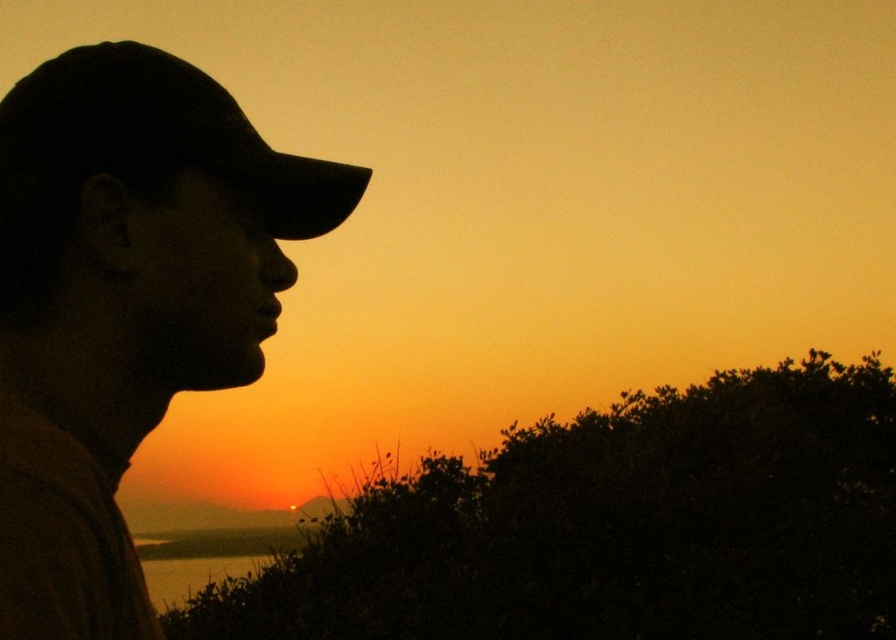
Can you confirm if silhouette cap at left is bigger than black matte baseball hat at left?

Yes, silhouette cap at left is bigger than black matte baseball hat at left.

Between silhouette cap at left and black matte baseball hat at left, which one has less height?

black matte baseball hat at left

Who is more distant from viewer, (22, 317) or (145, 61)?

The point (145, 61) is more distant.

Image resolution: width=896 pixels, height=640 pixels. What are the coordinates of `silhouette cap at left` in the screenshot? It's located at (125, 305).